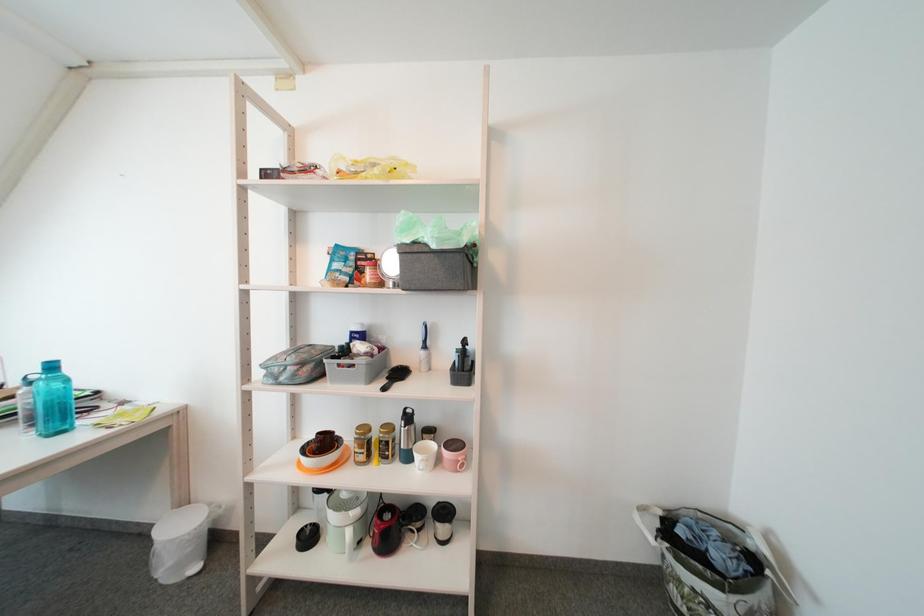
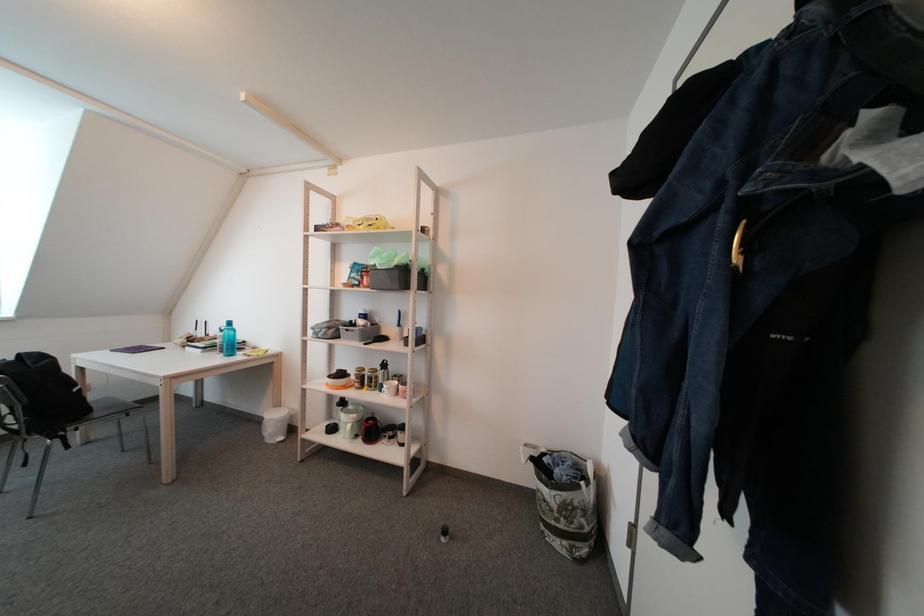
Question: The camera is either moving clockwise (left) or counter-clockwise (right) around the object. The first image is from the beginning of the video and the second image is from the end. Is the camera moving left or right when shooting the video?

Choices:
 (A) Left
 (B) Right

Answer: (B)